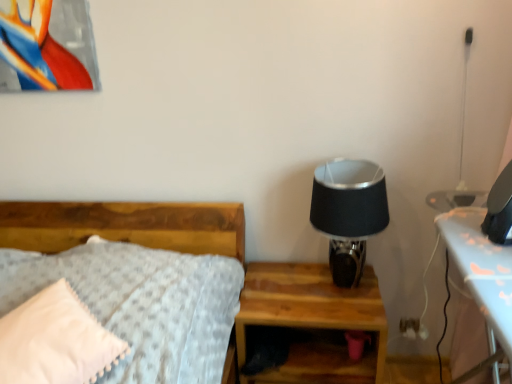
Question: Does white plastic electric outlet at lower right come in front of black fabric lampshade at upper right?

Choices:
 (A) no
 (B) yes

Answer: (A)

Question: Is white plastic electric outlet at lower right wider than black fabric lampshade at upper right?

Choices:
 (A) no
 (B) yes

Answer: (A)

Question: From a real-world perspective, does white plastic electric outlet at lower right stand above black fabric lampshade at upper right?

Choices:
 (A) yes
 (B) no

Answer: (B)

Question: Is white plastic electric outlet at lower right outside black fabric lampshade at upper right?

Choices:
 (A) no
 (B) yes

Answer: (B)

Question: Would you say white plastic electric outlet at lower right contains black fabric lampshade at upper right?

Choices:
 (A) yes
 (B) no

Answer: (B)

Question: Is the position of white plastic electric outlet at lower right more distant than that of black fabric lampshade at upper right?

Choices:
 (A) yes
 (B) no

Answer: (A)

Question: Can we say wooden nightstand at lower right lies outside white plastic electric outlet at lower right?

Choices:
 (A) no
 (B) yes

Answer: (B)

Question: Is there a large distance between wooden nightstand at lower right and white plastic electric outlet at lower right?

Choices:
 (A) yes
 (B) no

Answer: (B)

Question: Is wooden nightstand at lower right wider than white plastic electric outlet at lower right?

Choices:
 (A) no
 (B) yes

Answer: (B)

Question: Considering the relative positions of wooden nightstand at lower right and white plastic electric outlet at lower right in the image provided, is wooden nightstand at lower right to the right of white plastic electric outlet at lower right from the viewer's perspective?

Choices:
 (A) no
 (B) yes

Answer: (A)

Question: From the image's perspective, does wooden nightstand at lower right appear lower than white plastic electric outlet at lower right?

Choices:
 (A) no
 (B) yes

Answer: (B)

Question: Does wooden nightstand at lower right lie behind white plastic electric outlet at lower right?

Choices:
 (A) yes
 (B) no

Answer: (B)

Question: Considering the relative sizes of white soft pillow at left and white plastic electric outlet at lower right in the image provided, is white soft pillow at left wider than white plastic electric outlet at lower right?

Choices:
 (A) yes
 (B) no

Answer: (A)